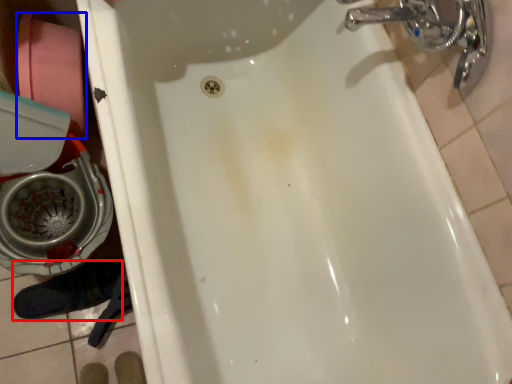
Question: Which object appears farthest to the camera in this image, shoe (highlighted by a red box) or toilet paper (highlighted by a blue box)?

Choices:
 (A) shoe
 (B) toilet paper

Answer: (A)